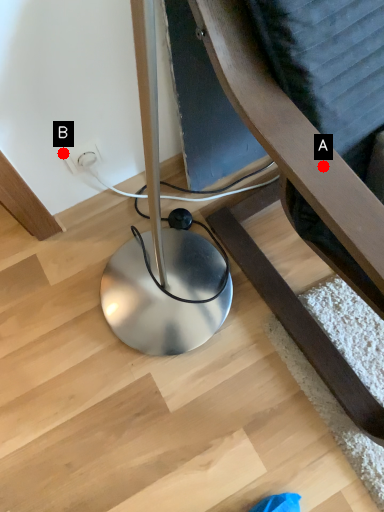
Question: Two points are circled on the image, labeled by A and B beside each circle. Which of the following is the farthest from the observer?

Choices:
 (A) A is further
 (B) B is further

Answer: (B)